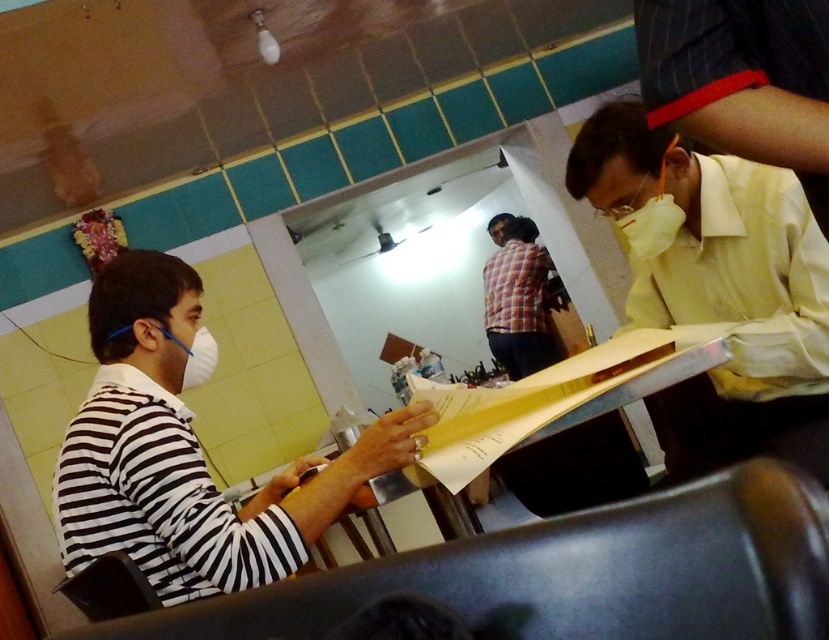
You are standing at the origin of the coordinate system in this indoor setting. There are two points marked in the scene. Which point, point (x=658, y=211) or point (x=183, y=371), is located behind the other?

Point (x=658, y=211) is behind point (x=183, y=371).

You are a photographer trying to capture a closeup of the yellow smooth shirt at right and the white matte mask at upper right. Since you want to focus on both items equally, which one should you adjust the camera focus on first, the one that is closer or farther away?

The yellow smooth shirt at right is taller than the white matte mask at upper right, so it is farther away. To focus on both equally, adjust the focus on the farther object first.

You are a customer in this restaurant and you want to pick up the white matte mask at upper right and the white matte mask at left. Which one is closer to your right hand if you are sitting at the table?

The white matte mask at upper right is to the right of the white matte mask at left, so the white matte mask at upper right is closer to your right hand.